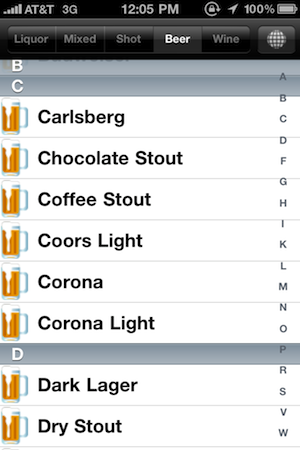
Find the location of `security lock`. security lock is located at coordinates (210, 9).